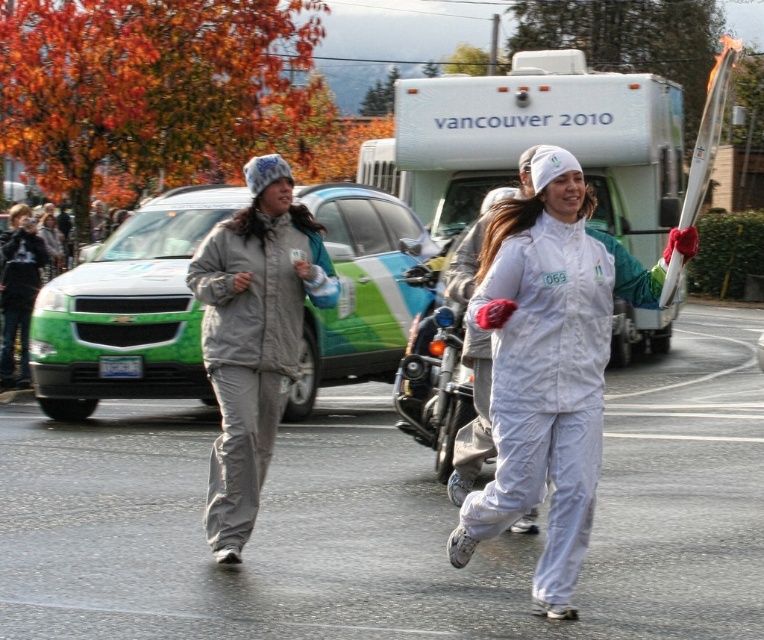
Consider the image. Between gray fleece jacket at left and shiny chrome motorcycle at center, which one has more height?

gray fleece jacket at left is taller.

Does point (267, 332) come behind point (436, 380)?

No, it is not.

You are a GUI agent. You are given a task and a screenshot of the screen. Output one action in this format:
    pyautogui.click(x=<x>, y=<y>)
    Task: Click on the gray fleece jacket at left
    The width and height of the screenshot is (764, 640).
    Given the screenshot: What is the action you would take?
    pyautogui.click(x=253, y=337)

In the scene shown: Which is above, white matte suit at center or shiny chrome motorcycle at center?

shiny chrome motorcycle at center

Does white matte suit at center have a greater width compared to shiny chrome motorcycle at center?

Indeed, white matte suit at center has a greater width compared to shiny chrome motorcycle at center.

Measure the distance between white matte suit at center and camera.

white matte suit at center and camera are 5.19 meters apart.

Locate an element on the screen. white matte suit at center is located at coordinates (549, 364).

Where is `white matte suit at center`? This screenshot has width=764, height=640. white matte suit at center is located at coordinates click(549, 364).

You are a GUI agent. You are given a task and a screenshot of the screen. Output one action in this format:
    pyautogui.click(x=<x>, y=<y>)
    Task: Click on the white matte suit at center
    
    Given the screenshot: What is the action you would take?
    pyautogui.click(x=549, y=364)